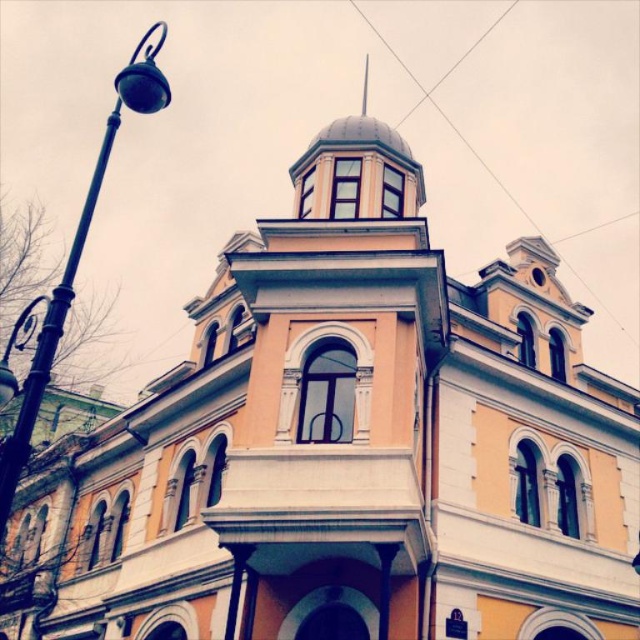
Question: Is black metal lamp post at left wider than smooth white spire at upper center?

Choices:
 (A) no
 (B) yes

Answer: (B)

Question: Among these points, which one is nearest to the camera?

Choices:
 (A) pyautogui.click(x=365, y=106)
 (B) pyautogui.click(x=8, y=499)

Answer: (B)

Question: Which object appears closest to the camera in this image?

Choices:
 (A) black metal lamp post at left
 (B) smooth white spire at upper center

Answer: (A)

Question: Does black metal lamp post at left have a larger size compared to smooth white spire at upper center?

Choices:
 (A) yes
 (B) no

Answer: (A)

Question: Is black metal lamp post at left further to camera compared to smooth white spire at upper center?

Choices:
 (A) no
 (B) yes

Answer: (A)

Question: Which point appears closest to the camera in this image?

Choices:
 (A) (369, 58)
 (B) (93, 209)

Answer: (B)